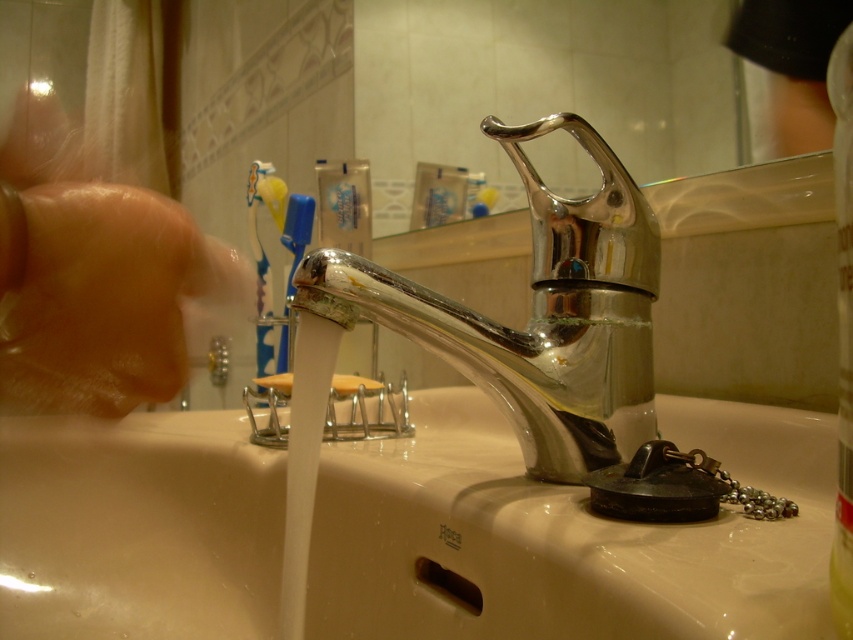
Question: Is dry skin at left above white matte soap at center?

Choices:
 (A) no
 (B) yes

Answer: (B)

Question: Estimate the real-world distances between objects in this image. Which object is closer to the white glossy sink at center?

Choices:
 (A) dry skin at left
 (B) polished chrome faucet at center
 (C) white matte soap at center

Answer: (B)

Question: Is dry skin at left below white matte soap at center?

Choices:
 (A) yes
 (B) no

Answer: (B)

Question: Which object appears closest to the camera in this image?

Choices:
 (A) white glossy sink at center
 (B) white matte soap at center
 (C) polished chrome faucet at center
 (D) dry skin at left

Answer: (D)

Question: Based on their relative distances, which object is nearer to the white matte soap at center?

Choices:
 (A) dry skin at left
 (B) white glossy sink at center

Answer: (B)

Question: Can you confirm if polished chrome faucet at center is positioned above white matte soap at center?

Choices:
 (A) no
 (B) yes

Answer: (B)